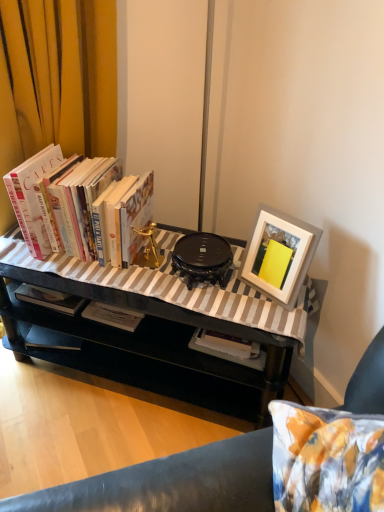
Question: Is the depth of black glossy table at center less than that of white matte picture frame at upper right?

Choices:
 (A) yes
 (B) no

Answer: (A)

Question: Is black glossy table at center aimed at white matte picture frame at upper right?

Choices:
 (A) yes
 (B) no

Answer: (B)

Question: Does black glossy table at center have a lesser height compared to white matte picture frame at upper right?

Choices:
 (A) no
 (B) yes

Answer: (A)

Question: From the image's perspective, is black glossy table at center below white matte picture frame at upper right?

Choices:
 (A) yes
 (B) no

Answer: (A)

Question: From a real-world perspective, is black glossy table at center positioned under white matte picture frame at upper right based on gravity?

Choices:
 (A) yes
 (B) no

Answer: (A)

Question: Can you confirm if black glossy table at center is positioned to the left of white matte picture frame at upper right?

Choices:
 (A) no
 (B) yes

Answer: (B)

Question: Is hardcover books at left thinner than black glossy table at center?

Choices:
 (A) no
 (B) yes

Answer: (B)

Question: Does hardcover books at left have a larger size compared to black glossy table at center?

Choices:
 (A) yes
 (B) no

Answer: (B)

Question: Can you confirm if hardcover books at left is taller than black glossy table at center?

Choices:
 (A) no
 (B) yes

Answer: (A)

Question: Does hardcover books at left come in front of black glossy table at center?

Choices:
 (A) yes
 (B) no

Answer: (B)

Question: Would you say hardcover books at left contains black glossy table at center?

Choices:
 (A) no
 (B) yes

Answer: (A)

Question: Is hardcover books at left touching black glossy table at center?

Choices:
 (A) yes
 (B) no

Answer: (B)

Question: Does hardcover books at left have a lesser width compared to white matte picture frame at upper right?

Choices:
 (A) no
 (B) yes

Answer: (A)